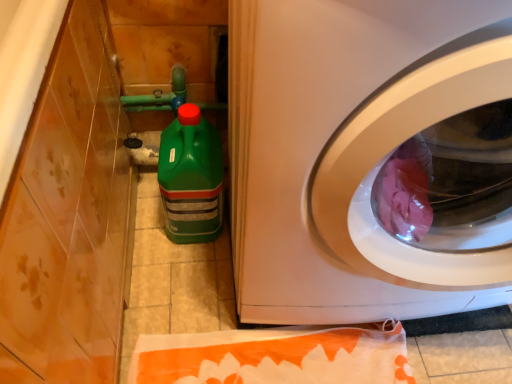
Question: Considering the relative sizes of green plastic bottle at lower left and white glossy washing machine at center in the image provided, is green plastic bottle at lower left shorter than white glossy washing machine at center?

Choices:
 (A) yes
 (B) no

Answer: (A)

Question: Is green plastic bottle at lower left thinner than white glossy washing machine at center?

Choices:
 (A) no
 (B) yes

Answer: (B)

Question: From a real-world perspective, is green plastic bottle at lower left under white glossy washing machine at center?

Choices:
 (A) no
 (B) yes

Answer: (B)

Question: Does green plastic bottle at lower left have a smaller size compared to white glossy washing machine at center?

Choices:
 (A) no
 (B) yes

Answer: (B)

Question: Is green plastic bottle at lower left facing towards white glossy washing machine at center?

Choices:
 (A) yes
 (B) no

Answer: (B)

Question: From a real-world perspective, is green plastic bottle at lower left positioned over white glossy washing machine at center based on gravity?

Choices:
 (A) no
 (B) yes

Answer: (A)

Question: Could you tell me if white glossy washing machine at center is facing green plastic bottle at lower left?

Choices:
 (A) no
 (B) yes

Answer: (A)

Question: Is white glossy washing machine at center closer to camera compared to green plastic bottle at lower left?

Choices:
 (A) yes
 (B) no

Answer: (A)

Question: Considering the relative sizes of white glossy washing machine at center and green plastic bottle at lower left in the image provided, is white glossy washing machine at center wider than green plastic bottle at lower left?

Choices:
 (A) no
 (B) yes

Answer: (B)

Question: From a real-world perspective, is white glossy washing machine at center on green plastic bottle at lower left?

Choices:
 (A) yes
 (B) no

Answer: (A)

Question: Does white glossy washing machine at center have a lesser height compared to green plastic bottle at lower left?

Choices:
 (A) no
 (B) yes

Answer: (A)

Question: Is white glossy washing machine at center positioned with its back to green plastic bottle at lower left?

Choices:
 (A) yes
 (B) no

Answer: (B)

Question: From the image's perspective, relative to white glossy washing machine at center, is green plastic bottle at lower left above or below?

Choices:
 (A) below
 (B) above

Answer: (A)